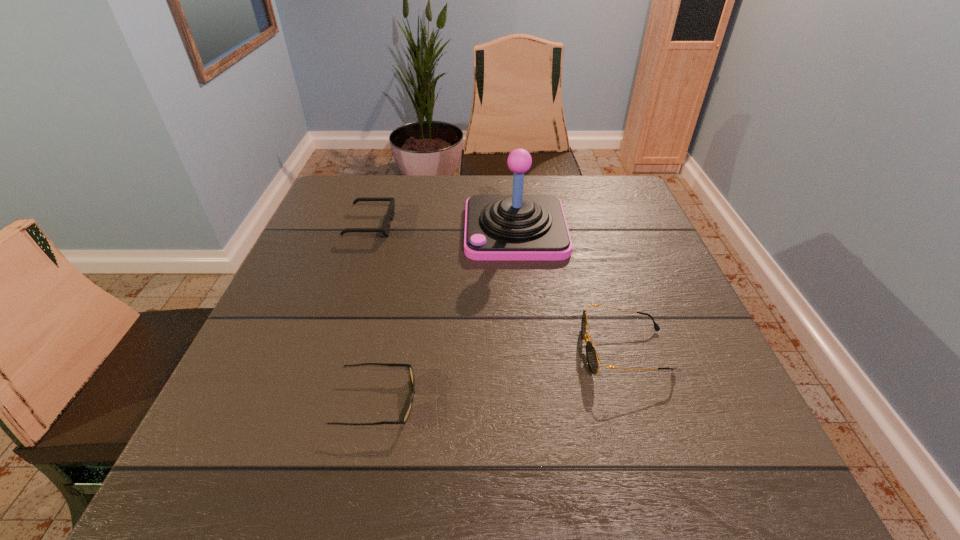
You are a GUI agent. You are given a task and a screenshot of the screen. Output one action in this format:
    pyautogui.click(x=<x>, y=<y>)
    Task: Click on the vacant space located on the front-facing side of the farthest sunglasses
    This screenshot has width=960, height=540.
    Given the screenshot: What is the action you would take?
    pyautogui.click(x=526, y=225)

At what (x,y) coordinates should I click in order to perform the action: click on joystick that is at the far edge. Please return your answer as a coordinate pair (x, y). The width and height of the screenshot is (960, 540). Looking at the image, I should click on point(517,227).

Identify the location of sunglasses at the far edge. This screenshot has height=540, width=960. (385, 230).

Image resolution: width=960 pixels, height=540 pixels. Find the location of `object present at the left edge`. object present at the left edge is located at coordinates (385, 230).

Find the location of a particular element. This screenshot has height=540, width=960. object that is positioned at the right edge is located at coordinates (592, 358).

I want to click on object at the far left corner, so (x=385, y=230).

Where is `free space at the far edge`? This screenshot has height=540, width=960. free space at the far edge is located at coordinates (438, 202).

This screenshot has width=960, height=540. I want to click on vacant area at the near edge, so click(x=479, y=454).

The width and height of the screenshot is (960, 540). Find the location of `vacant space at the left edge of the desktop`. vacant space at the left edge of the desktop is located at coordinates (324, 238).

Where is `vacant space at the right edge of the desktop`? This screenshot has width=960, height=540. vacant space at the right edge of the desktop is located at coordinates (671, 285).